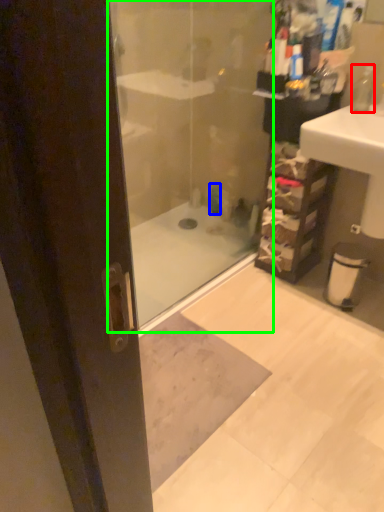
Question: Which is nearer to the soap dispenser (highlighted by a red box)? toiletry (highlighted by a blue box) or shower door (highlighted by a green box).

Choices:
 (A) toiletry
 (B) shower door

Answer: (A)